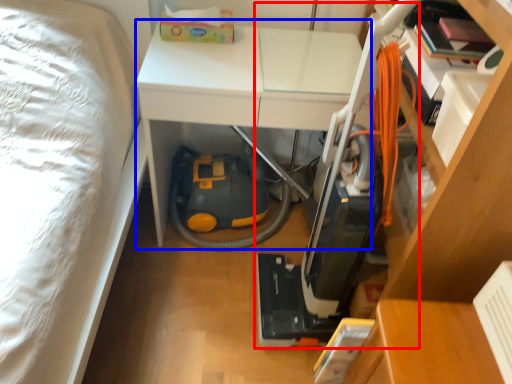
Question: Among these objects, which one is farthest to the camera, vacuum (highlighted by a red box) or table (highlighted by a blue box)?

Choices:
 (A) vacuum
 (B) table

Answer: (B)